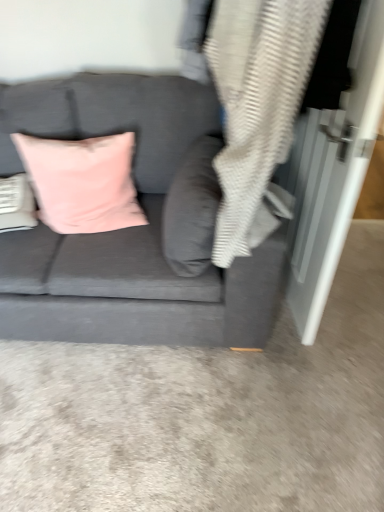
This screenshot has width=384, height=512. What are the coordinates of `gray textured blanket at upper right` in the screenshot? It's located at (257, 100).

Describe the element at coordinates (129, 228) in the screenshot. Image resolution: width=384 pixels, height=512 pixels. I see `velvet gray couch at center` at that location.

Find the location of a particular element. The height and width of the screenshot is (512, 384). gray textured blanket at upper right is located at coordinates (257, 100).

Considering the points (202, 186) and (109, 147), which point is behind, point (202, 186) or point (109, 147)?

The point (109, 147) is more distant.

Is pink velvet cushion at upper left, positioned as the first pillow in left-to-right order, completely or partially inside velvet pink pillow at center, marked as the first pillow in a right-to-left arrangement?

Definitely not — pink velvet cushion at upper left, positioned as the first pillow in left-to-right order, is not inside velvet pink pillow at center, marked as the first pillow in a right-to-left arrangement.

From a real-world perspective, which is physically above, velvet pink pillow at center, marked as the first pillow in a right-to-left arrangement, or pink velvet cushion at upper left, positioned as the first pillow in left-to-right order?

velvet pink pillow at center, marked as the first pillow in a right-to-left arrangement, is physically above.

Are velvet pink pillow at center, marked as the first pillow in a right-to-left arrangement, and pink velvet cushion at upper left, which ranks as the second pillow in right-to-left order, located far from each other?

No.

From the image's perspective, is velvet pink pillow at center, marked as the first pillow in a right-to-left arrangement, beneath gray textured blanket at upper right?

Yes.

From the gray textured blanket at upper right, count 1st pillows backward and point to it. Please provide its 2D coordinates.

[(192, 209)]

Considering the sizes of objects velvet pink pillow at center, marked as the first pillow in a right-to-left arrangement, and gray textured blanket at upper right in the image provided, who is thinner, velvet pink pillow at center, marked as the first pillow in a right-to-left arrangement, or gray textured blanket at upper right?

Thinner between the two is velvet pink pillow at center, marked as the first pillow in a right-to-left arrangement.

Measure the distance between velvet pink pillow at center, arranged as the 2th pillow when viewed from the left, and gray textured blanket at upper right.

velvet pink pillow at center, arranged as the 2th pillow when viewed from the left, and gray textured blanket at upper right are 8.80 inches apart.

Is point (144, 150) farther from camera compared to point (264, 38)?

Yes, it is behind point (264, 38).

Which object is thinner, velvet gray couch at center or gray textured blanket at upper right?

With smaller width is gray textured blanket at upper right.

Would you say velvet gray couch at center is a long distance from gray textured blanket at upper right?

They are positioned close to each other.

Does velvet pink pillow at center, marked as the first pillow in a right-to-left arrangement, lie in front of velvet gray couch at center?

That is False.

Which of these two, velvet pink pillow at center, arranged as the 2th pillow when viewed from the left, or velvet gray couch at center, is smaller?

With smaller size is velvet pink pillow at center, arranged as the 2th pillow when viewed from the left.

Is velvet pink pillow at center, marked as the first pillow in a right-to-left arrangement, facing away from velvet gray couch at center?

Yes, velvet gray couch at center is at the back of velvet pink pillow at center, marked as the first pillow in a right-to-left arrangement.

How much distance is there between velvet pink pillow at center, arranged as the 2th pillow when viewed from the left, and velvet gray couch at center?

The distance of velvet pink pillow at center, arranged as the 2th pillow when viewed from the left, from velvet gray couch at center is 19.66 centimeters.

In the scene shown: Which of these two, velvet gray couch at center or velvet pink pillow at center, arranged as the 2th pillow when viewed from the left, is smaller?

With smaller size is velvet pink pillow at center, arranged as the 2th pillow when viewed from the left.

How much distance is there between velvet gray couch at center and velvet pink pillow at center, marked as the first pillow in a right-to-left arrangement?

The distance of velvet gray couch at center from velvet pink pillow at center, marked as the first pillow in a right-to-left arrangement, is 7.74 inches.

Can we say velvet gray couch at center lies outside velvet pink pillow at center, marked as the first pillow in a right-to-left arrangement?

Indeed, velvet gray couch at center is completely outside velvet pink pillow at center, marked as the first pillow in a right-to-left arrangement.

The height and width of the screenshot is (512, 384). Identify the location of studio couch located underneath the velvet pink pillow at center, arranged as the 2th pillow when viewed from the left (from a real-world perspective). click(129, 228).

Which is behind, gray textured blanket at upper right or velvet pink pillow at center, marked as the first pillow in a right-to-left arrangement?

velvet pink pillow at center, marked as the first pillow in a right-to-left arrangement, is further from the camera.

From the picture: Is gray textured blanket at upper right positioned beyond the bounds of velvet pink pillow at center, arranged as the 2th pillow when viewed from the left?

That's correct, gray textured blanket at upper right is outside of velvet pink pillow at center, arranged as the 2th pillow when viewed from the left.

Which point is more forward, (217, 169) or (211, 250)?

Positioned in front is point (217, 169).

From the image's perspective, is gray textured blanket at upper right positioned above or below velvet pink pillow at center, arranged as the 2th pillow when viewed from the left?

gray textured blanket at upper right is situated higher than velvet pink pillow at center, arranged as the 2th pillow when viewed from the left, in the image.

From a real-world perspective, is pink velvet cushion at upper left, positioned as the first pillow in left-to-right order, located higher than velvet gray couch at center?

Correct, in the physical world, pink velvet cushion at upper left, positioned as the first pillow in left-to-right order, is higher than velvet gray couch at center.

Looking at this image, can you confirm if pink velvet cushion at upper left, which ranks as the second pillow in right-to-left order, is thinner than velvet gray couch at center?

Correct, the width of pink velvet cushion at upper left, which ranks as the second pillow in right-to-left order, is less than that of velvet gray couch at center.

Which of these two, pink velvet cushion at upper left, which ranks as the second pillow in right-to-left order, or velvet gray couch at center, is bigger?

Bigger between the two is velvet gray couch at center.

Consider the image. Is pink velvet cushion at upper left, which ranks as the second pillow in right-to-left order, positioned beyond the bounds of velvet gray couch at center?

Actually, pink velvet cushion at upper left, which ranks as the second pillow in right-to-left order, is within velvet gray couch at center.

This screenshot has height=512, width=384. I want to click on pillow located below the pink velvet cushion at upper left, which ranks as the second pillow in right-to-left order (from the image's perspective), so click(x=192, y=209).

You are a GUI agent. You are given a task and a screenshot of the screen. Output one action in this format:
    pyautogui.click(x=<x>, y=<y>)
    Task: Click on the material above the velvet pink pillow at center, arranged as the 2th pillow when viewed from the left (from the image's perspective)
    This screenshot has height=512, width=384.
    Given the screenshot: What is the action you would take?
    pyautogui.click(x=257, y=100)

Based on their spatial positions, is velvet pink pillow at center, arranged as the 2th pillow when viewed from the left, or pink velvet cushion at upper left, which ranks as the second pillow in right-to-left order, further from velvet gray couch at center?

pink velvet cushion at upper left, which ranks as the second pillow in right-to-left order.

Considering their positions, is gray textured blanket at upper right positioned closer to velvet pink pillow at center, arranged as the 2th pillow when viewed from the left, than velvet gray couch at center?

Among the two, velvet gray couch at center is located nearer to velvet pink pillow at center, arranged as the 2th pillow when viewed from the left.

Looking at the image, which one is located further to velvet pink pillow at center, marked as the first pillow in a right-to-left arrangement, gray textured blanket at upper right or pink velvet cushion at upper left, which ranks as the second pillow in right-to-left order?

Among the two, pink velvet cushion at upper left, which ranks as the second pillow in right-to-left order, is located further to velvet pink pillow at center, marked as the first pillow in a right-to-left arrangement.

When comparing their distances from velvet pink pillow at center, marked as the first pillow in a right-to-left arrangement, does velvet gray couch at center or pink velvet cushion at upper left, positioned as the first pillow in left-to-right order, seem further?

pink velvet cushion at upper left, positioned as the first pillow in left-to-right order, lies further to velvet pink pillow at center, marked as the first pillow in a right-to-left arrangement, than the other object.

Which object lies further to the anchor point velvet pink pillow at center, arranged as the 2th pillow when viewed from the left, velvet gray couch at center or gray textured blanket at upper right?

gray textured blanket at upper right is positioned further to the anchor velvet pink pillow at center, arranged as the 2th pillow when viewed from the left.

Estimate the real-world distances between objects in this image. Which object is further from gray textured blanket at upper right, velvet gray couch at center or pink velvet cushion at upper left, which ranks as the second pillow in right-to-left order?

pink velvet cushion at upper left, which ranks as the second pillow in right-to-left order.

Estimate the real-world distances between objects in this image. Which object is closer to velvet pink pillow at center, arranged as the 2th pillow when viewed from the left, pink velvet cushion at upper left, which ranks as the second pillow in right-to-left order, or gray textured blanket at upper right?

gray textured blanket at upper right lies closer to velvet pink pillow at center, arranged as the 2th pillow when viewed from the left, than the other object.

When comparing their distances from pink velvet cushion at upper left, which ranks as the second pillow in right-to-left order, does velvet gray couch at center or velvet pink pillow at center, marked as the first pillow in a right-to-left arrangement, seem closer?

velvet gray couch at center is closer to pink velvet cushion at upper left, which ranks as the second pillow in right-to-left order.

Identify the location of pillow between pink velvet cushion at upper left, positioned as the first pillow in left-to-right order, and gray textured blanket at upper right. This screenshot has width=384, height=512. (192, 209).

Where is `studio couch between pink velvet cushion at upper left, which ranks as the second pillow in right-to-left order, and velvet pink pillow at center, marked as the first pillow in a right-to-left arrangement`? This screenshot has height=512, width=384. studio couch between pink velvet cushion at upper left, which ranks as the second pillow in right-to-left order, and velvet pink pillow at center, marked as the first pillow in a right-to-left arrangement is located at coordinates (129, 228).

In order to click on studio couch located between pink velvet cushion at upper left, positioned as the first pillow in left-to-right order, and gray textured blanket at upper right in the left-right direction in this screenshot , I will do `click(129, 228)`.

The image size is (384, 512). I want to click on pillow situated between velvet gray couch at center and gray textured blanket at upper right from left to right, so click(192, 209).